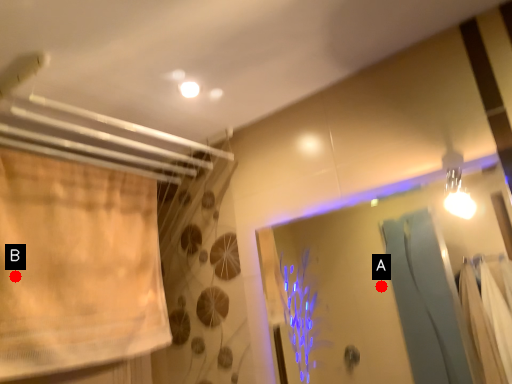
Question: Two points are circled on the image, labeled by A and B beside each circle. Which point is closer to the camera?

Choices:
 (A) A is closer
 (B) B is closer

Answer: (B)